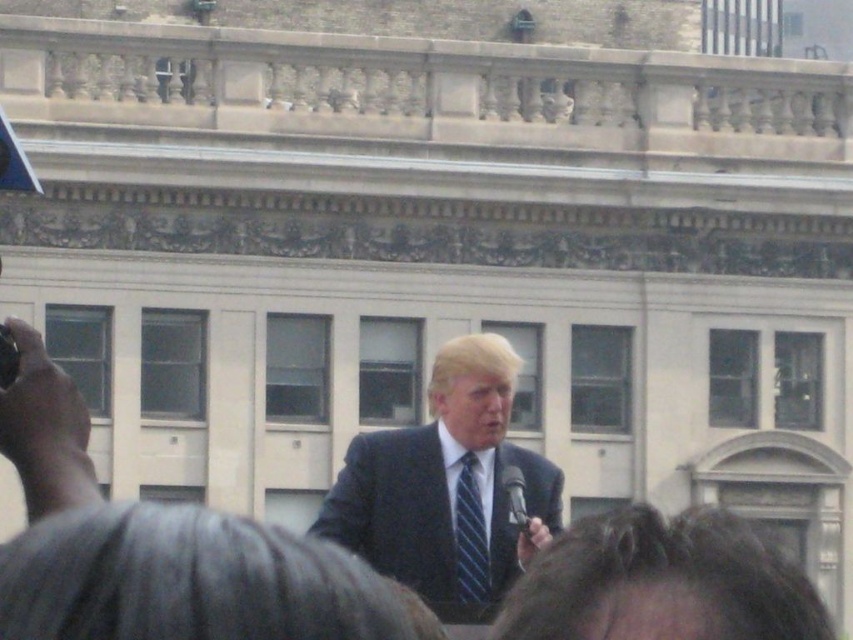
Who is lower down, dark blue suit at center or blue striped tie at center?

blue striped tie at center is below.

Between point (498, 554) and point (457, 476), which one is positioned behind?

Positioned behind is point (457, 476).

Find the location of `dark blue suit at center`. dark blue suit at center is located at coordinates (445, 486).

Can you confirm if blue striped tie at center is positioned above black plastic microphone at lower center?

Indeed, blue striped tie at center is positioned over black plastic microphone at lower center.

Is blue striped tie at center to the left of black plastic microphone at lower center from the viewer's perspective?

Yes, blue striped tie at center is to the left of black plastic microphone at lower center.

Between point (457, 573) and point (514, 513), which one is positioned in front?

Point (514, 513) is in front.

The width and height of the screenshot is (853, 640). I want to click on blue striped tie at center, so click(469, 536).

Is dark blue suit at center positioned behind black plastic microphone at lower center?

Yes, it is behind black plastic microphone at lower center.

In the scene shown: Does dark blue suit at center appear on the right side of black plastic microphone at lower center?

Incorrect, dark blue suit at center is not on the right side of black plastic microphone at lower center.

Image resolution: width=853 pixels, height=640 pixels. Describe the element at coordinates (445, 486) in the screenshot. I see `dark blue suit at center` at that location.

I want to click on dark blue suit at center, so click(x=445, y=486).